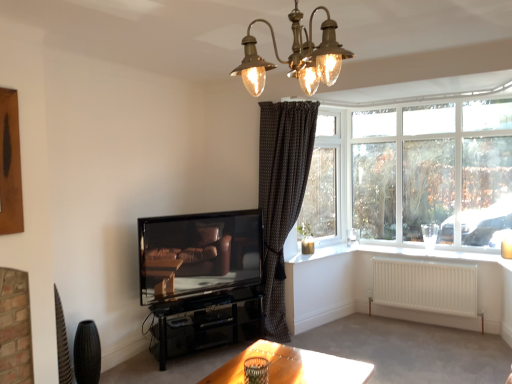
At what (x,y) coordinates should I click in order to perform the action: click on free space between brown dotted fabric curtain at center and white matte radiator at lower right. Please return your answer as a coordinate pair (x, y). Looking at the image, I should click on (377, 336).